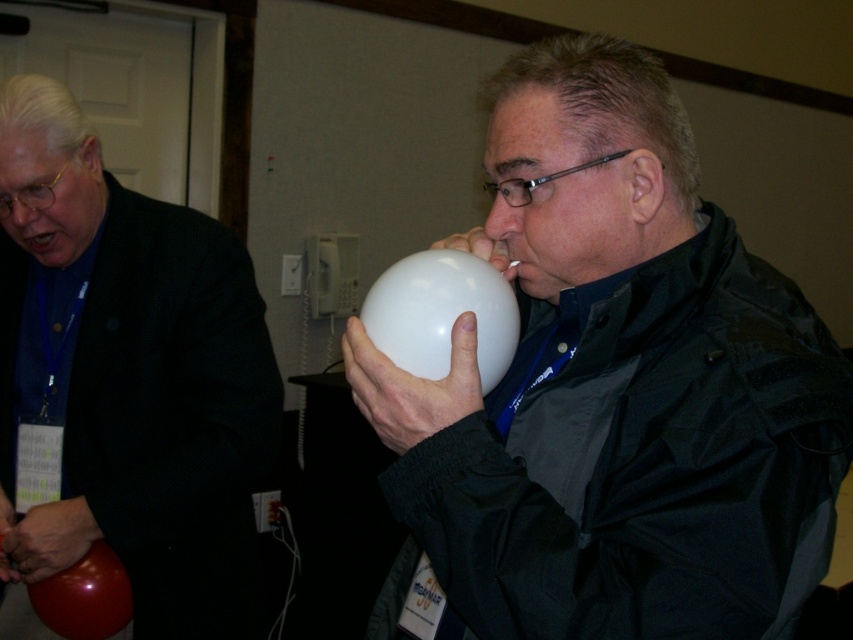
You are a photographer positioned at the camera. You want to capture a closeup shot of the white matte balloon at center. Considering your current position, do you need to move closer or farther away to achieve this?

The white matte balloon at center and camera are 23.03 inches apart. To capture a closeup shot, you need to move closer to the balloon since the current distance is already quite close but might require reducing it further for optimal framing.